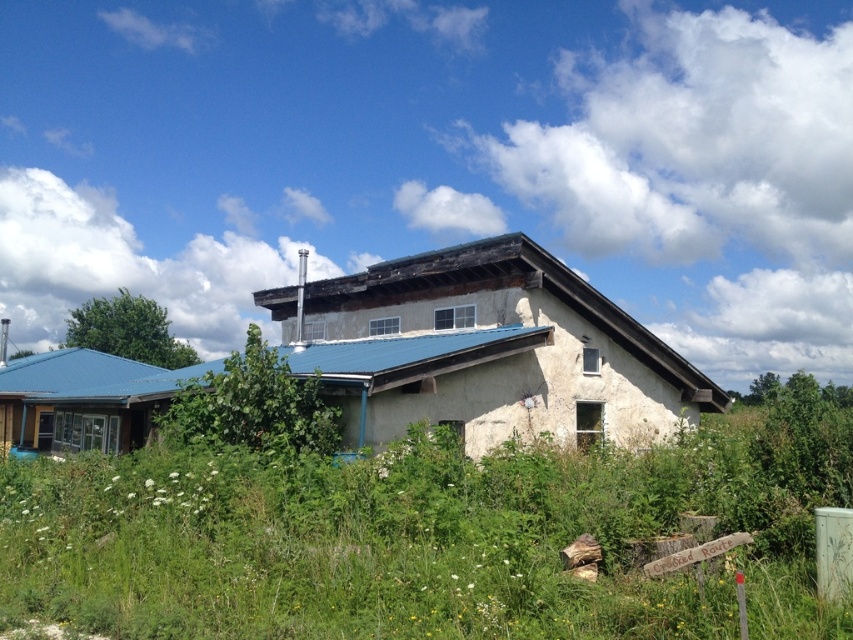
Does green grass at center have a lesser height compared to matte blue siding at left?

Yes, green grass at center is shorter than matte blue siding at left.

Does point (700, 474) come closer to viewer compared to point (132, 380)?

That is True.

Locate an element on the screen. The image size is (853, 640). green grass at center is located at coordinates (402, 541).

Based on the photo, which of these two, green grass at center or stucco house at center, stands taller?

With more height is stucco house at center.

Find the location of a particular element. This screenshot has width=853, height=640. green grass at center is located at coordinates (402, 541).

Does stucco house at center have a greater height compared to matte blue siding at left?

Yes.

Describe the element at coordinates (486, 349) in the screenshot. I see `stucco house at center` at that location.

Identify the location of stucco house at center. Image resolution: width=853 pixels, height=640 pixels. (486, 349).